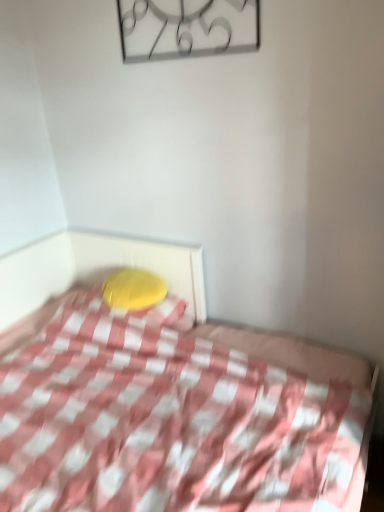
Question: Is metallic clock at upper center aimed at yellow fabric pillow at center?

Choices:
 (A) yes
 (B) no

Answer: (B)

Question: From the image's perspective, is metallic clock at upper center over yellow fabric pillow at center?

Choices:
 (A) yes
 (B) no

Answer: (A)

Question: Considering the relative sizes of metallic clock at upper center and yellow fabric pillow at center in the image provided, is metallic clock at upper center taller than yellow fabric pillow at center?

Choices:
 (A) no
 (B) yes

Answer: (B)

Question: From a real-world perspective, is metallic clock at upper center on top of yellow fabric pillow at center?

Choices:
 (A) yes
 (B) no

Answer: (A)

Question: Is metallic clock at upper center further to camera compared to yellow fabric pillow at center?

Choices:
 (A) yes
 (B) no

Answer: (B)

Question: Is metallic clock at upper center positioned far away from yellow fabric pillow at center?

Choices:
 (A) yes
 (B) no

Answer: (A)

Question: Does yellow fabric pillow at center touch pink checkered fabric at center?

Choices:
 (A) no
 (B) yes

Answer: (A)

Question: Is yellow fabric pillow at center far away from pink checkered fabric at center?

Choices:
 (A) no
 (B) yes

Answer: (A)

Question: Would you say pink checkered fabric at center is part of yellow fabric pillow at center's contents?

Choices:
 (A) yes
 (B) no

Answer: (B)

Question: From a real-world perspective, is yellow fabric pillow at center located beneath pink checkered fabric at center?

Choices:
 (A) no
 (B) yes

Answer: (A)

Question: From a real-world perspective, is yellow fabric pillow at center physically above pink checkered fabric at center?

Choices:
 (A) yes
 (B) no

Answer: (A)

Question: Is yellow fabric pillow at center aimed at pink checkered fabric at center?

Choices:
 (A) yes
 (B) no

Answer: (A)

Question: Does pink checkered fabric at center have a greater width compared to yellow fabric pillow at center?

Choices:
 (A) yes
 (B) no

Answer: (A)